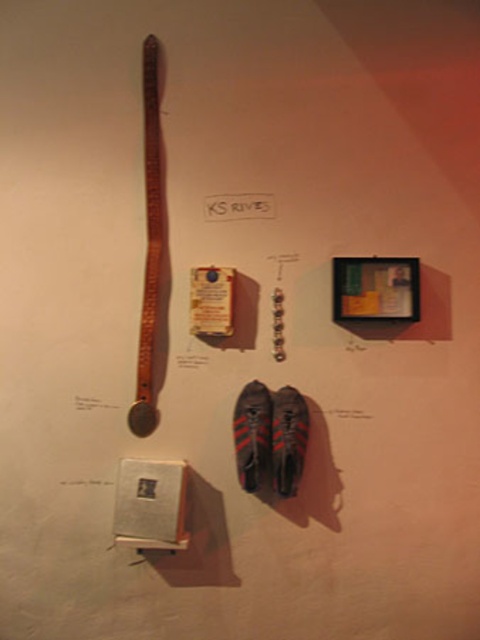
Question: From the image, what is the correct spatial relationship of reddish-brown leather shoe at center in relation to black leather shoe at lower center?

Choices:
 (A) above
 (B) below

Answer: (A)

Question: Which point is closer to the camera taking this photo?

Choices:
 (A) (260, 458)
 (B) (276, 410)

Answer: (A)

Question: Which object appears closest to the camera in this image?

Choices:
 (A) black leather shoe at lower center
 (B) reddish-brown leather shoe at center

Answer: (A)

Question: Which point is farther to the camera?

Choices:
 (A) black leather shoe at lower center
 (B) reddish-brown leather shoe at center

Answer: (B)

Question: Can you confirm if reddish-brown leather shoe at center is positioned above black leather shoe at lower center?

Choices:
 (A) yes
 (B) no

Answer: (A)

Question: Is reddish-brown leather shoe at center below black leather shoe at lower center?

Choices:
 (A) no
 (B) yes

Answer: (A)